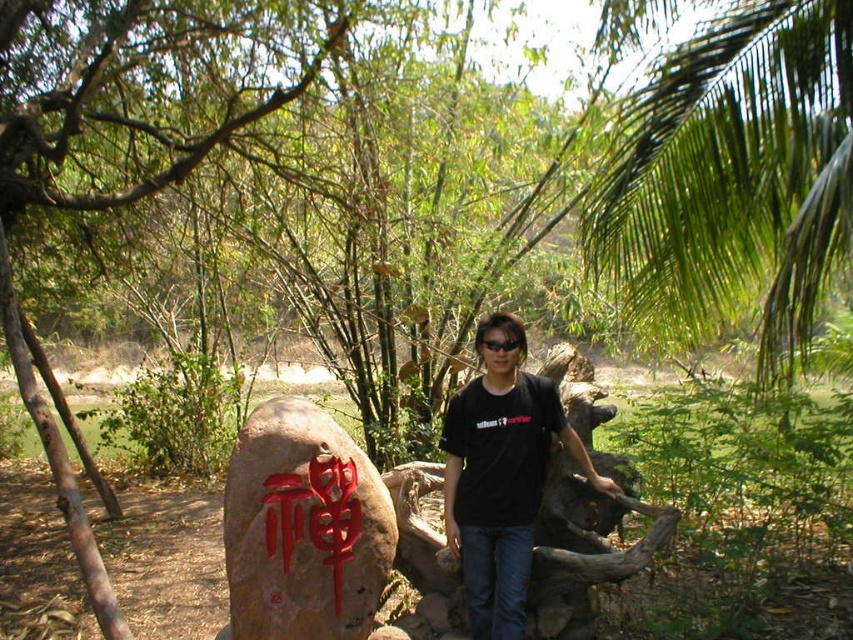
You are standing at the point with coordinates point [521,349] and want to walk towards the large rock with red Chinese characters. Is the point point [509,566] located between you and the rock?

Yes, the point point [509,566] is between you and the rock because it is in front of point [521,349], which is your current position.

You are a photographer trying to capture both the red carved stone at center and the black plastic goggles at center in a single frame. Which object should you focus on first to ensure both fit in the frame?

The red carved stone at center is wider than the black plastic goggles at center, so you should focus on the red carved stone at center first to ensure both fit in the frame.